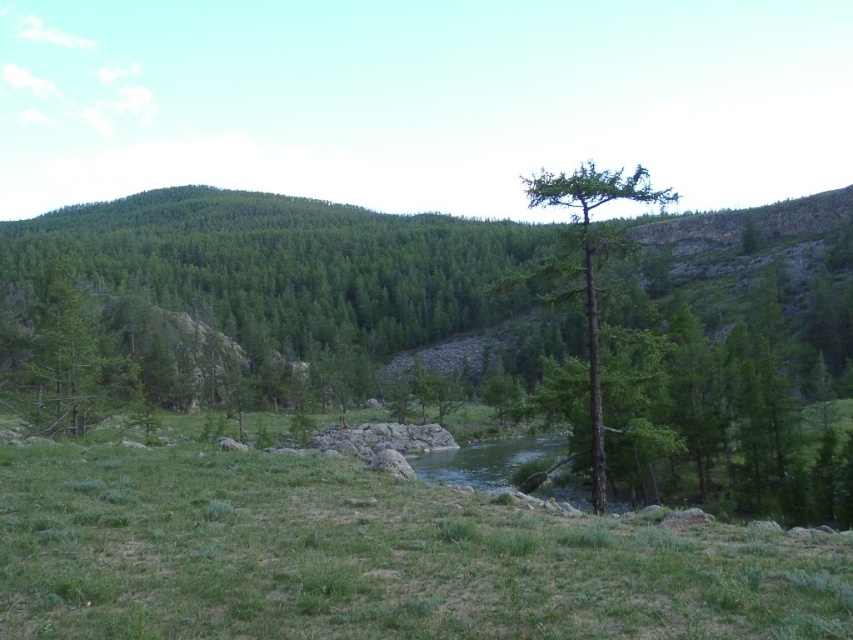
Locate an element on the screen. The image size is (853, 640). green matte tree at left is located at coordinates (65, 356).

Which is behind, point (74, 308) or point (610, 244)?

The point (74, 308) is more distant.

Is point (33, 356) positioned after point (593, 259)?

Yes.

Find the location of a particular element. This screenshot has height=640, width=853. green matte tree at left is located at coordinates point(65,356).

Between point (155, 273) and point (138, 570), which one is positioned behind?

Positioned behind is point (155, 273).

Between green matte tree at center and green grassy at center, which one appears on the right side from the viewer's perspective?

green grassy at center is more to the right.

Does point (756, 384) come closer to viewer compared to point (575, 518)?

That is False.

This screenshot has width=853, height=640. I want to click on green matte tree at center, so (305, 296).

Is green matte tree at center bigger than green rough bark tree at center?

No, green matte tree at center is not bigger than green rough bark tree at center.

Does green matte tree at center appear over green rough bark tree at center?

Actually, green matte tree at center is below green rough bark tree at center.

Find the location of a particular element. green matte tree at center is located at coordinates (305, 296).

Identify the location of green matte tree at center. The height and width of the screenshot is (640, 853). (305, 296).